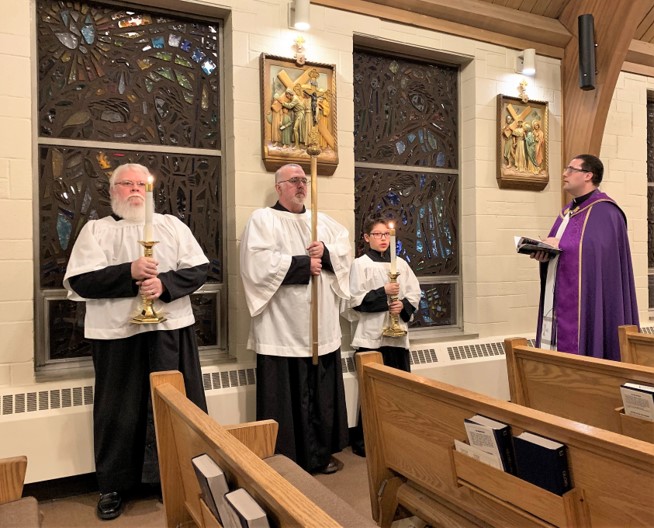
Find the location of a particular element. The height and width of the screenshot is (528, 654). light is located at coordinates (307, 18), (524, 63).